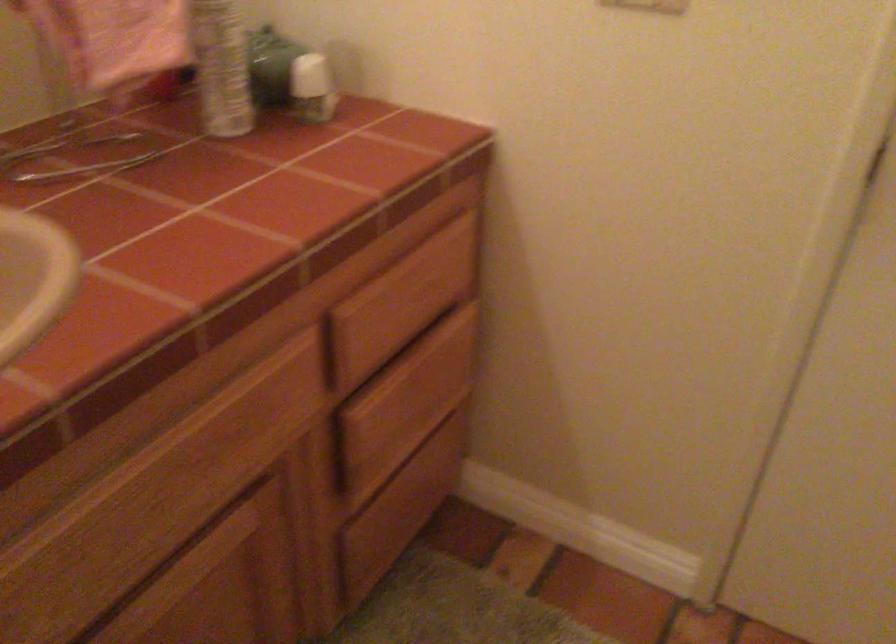
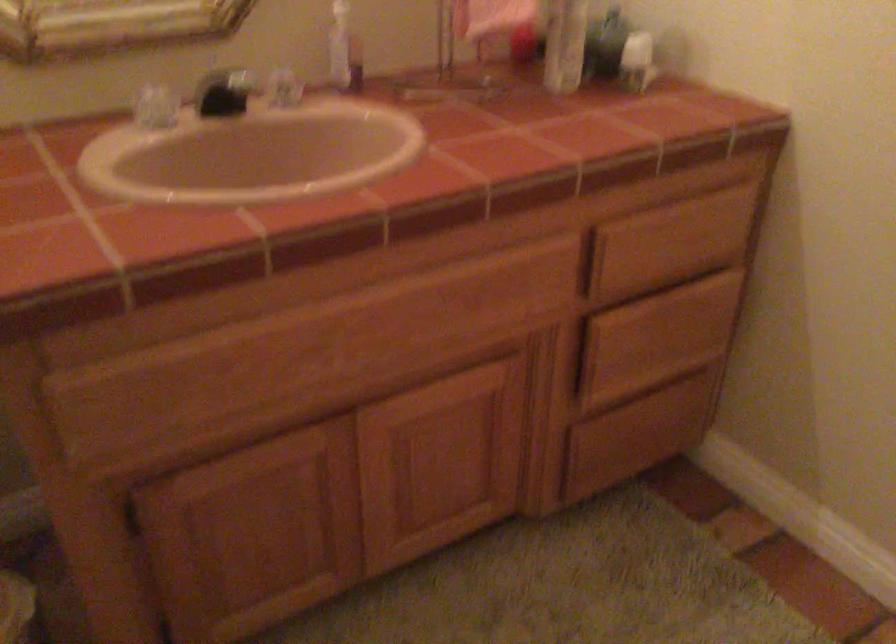
Question: The camera is either moving clockwise (left) or counter-clockwise (right) around the object. The first image is from the beginning of the video and the second image is from the end. Is the camera moving left or right when shooting the video?

Choices:
 (A) Left
 (B) Right

Answer: (B)